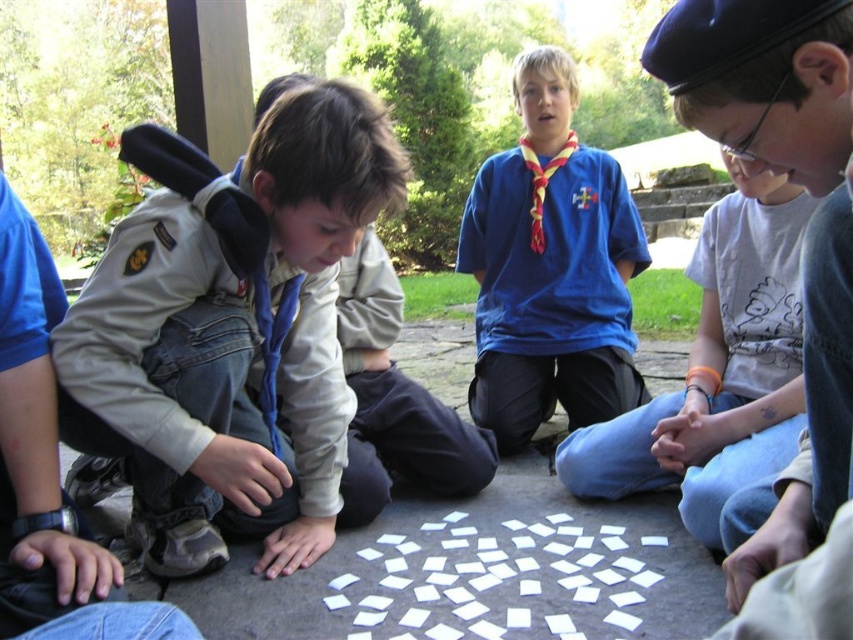
You are a photographer standing at the edge of the park. You want to take a photo of the blue cotton shirt at center and the white paper squares at center such that both are in focus. The camera you are using has a depth of field that can cover 70 centimeters. Will both objects be in focus in the photo?

The blue cotton shirt at center and the white paper squares at center are 70.68 centimeters apart from each other. Since the camera can cover 70 centimeters, the distance between them is slightly more than the depth of field. Therefore, both objects may not be fully in focus in the photo.

In the park scene, there are children playing a game. The khaki uniform at center is represented by point (x=230, y=330). Which child is wearing the khaki uniform at center?

The khaki uniform at center is represented by point (x=230, y=330), so the child wearing it is the one located at that coordinate.